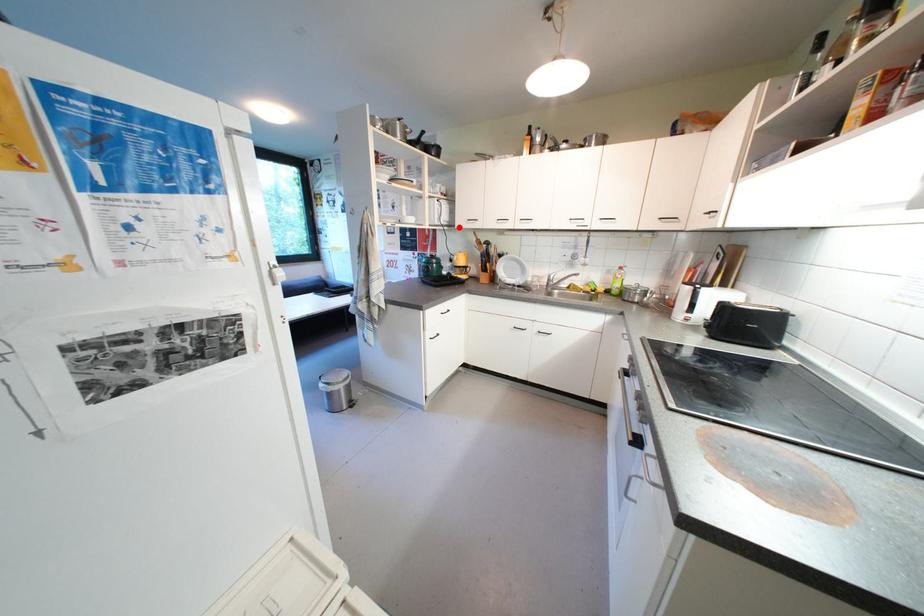
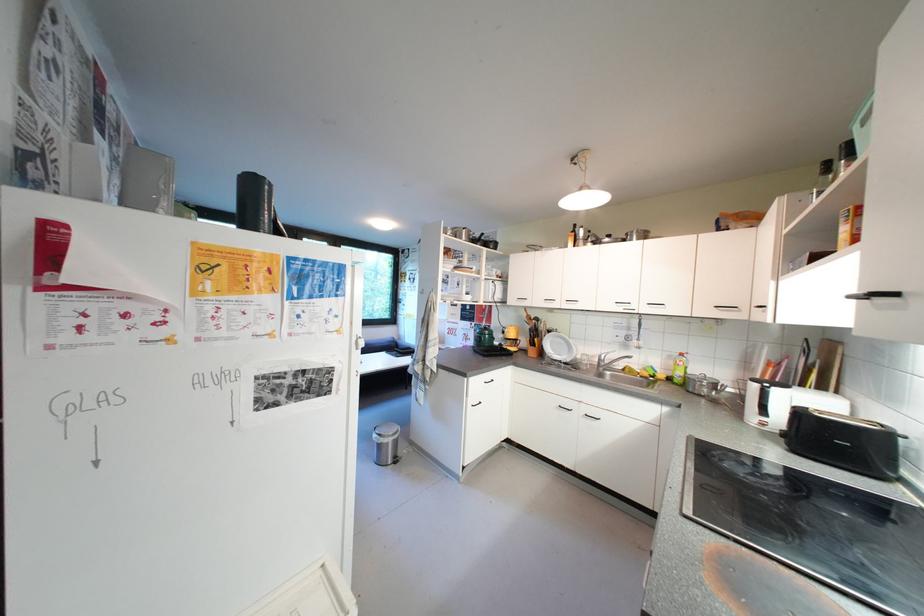
Locate, in the second image, the point that corresponds to the highlighted location in the first image.

(512, 304)